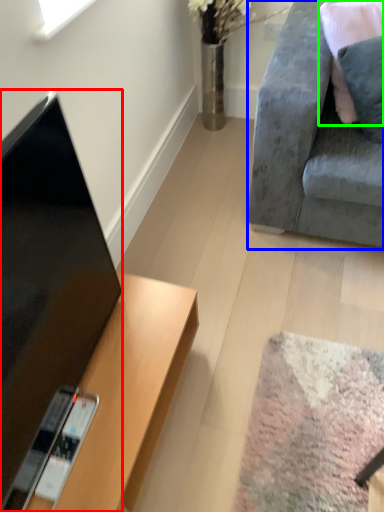
Question: Which is farther away from television (highlighted by a red box)? studio couch (highlighted by a blue box) or pillow (highlighted by a green box)?

Choices:
 (A) studio couch
 (B) pillow

Answer: (B)